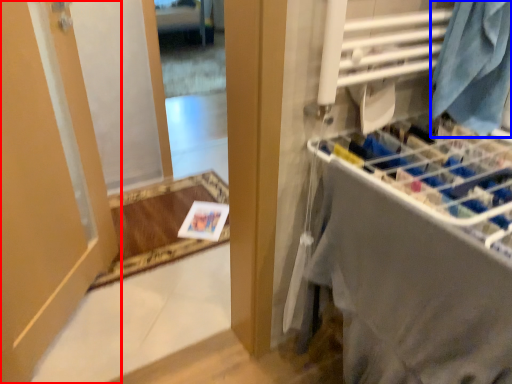
Question: Which of the following is the farthest to the observer, door (highlighted by a red box) or clothing (highlighted by a blue box)?

Choices:
 (A) door
 (B) clothing

Answer: (B)